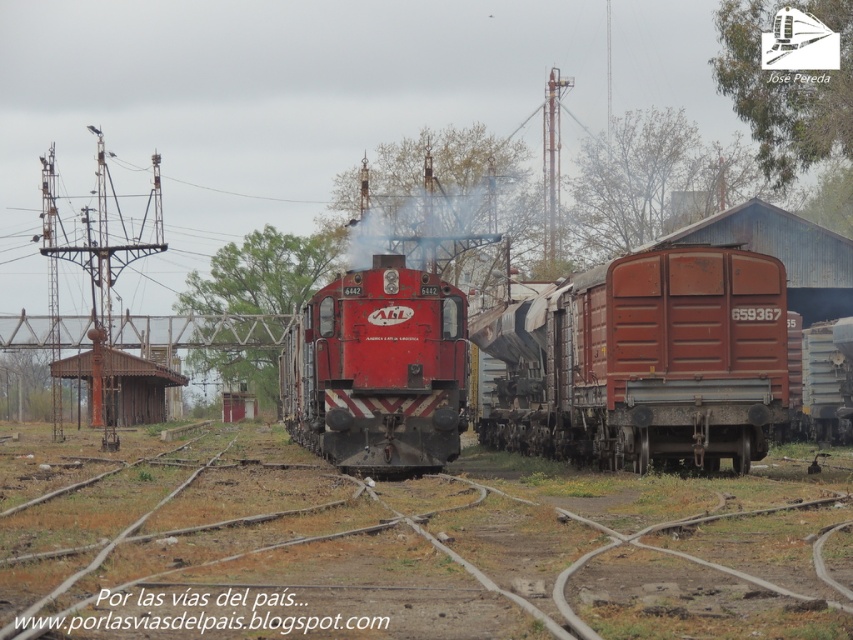
Question: From the image, what is the correct spatial relationship of rusty metal train car at right in relation to shiny red locomotive at center?

Choices:
 (A) below
 (B) above

Answer: (B)

Question: Which point is closer to the camera?

Choices:
 (A) (363, 470)
 (B) (701, 520)
 (C) (662, 406)

Answer: (B)

Question: Is rusty metal train car at right bigger than shiny red locomotive at center?

Choices:
 (A) yes
 (B) no

Answer: (B)

Question: Which of the following is the farthest from the observer?

Choices:
 (A) shiny red locomotive at center
 (B) rusty metal train car at right
 (C) brown dirt train track at center

Answer: (A)

Question: Considering the relative positions of rusty metal train car at right and shiny red locomotive at center in the image provided, where is rusty metal train car at right located with respect to shiny red locomotive at center?

Choices:
 (A) below
 (B) above

Answer: (B)

Question: Which object is closer to the camera taking this photo?

Choices:
 (A) rusty metal train car at right
 (B) shiny red locomotive at center
 (C) brown dirt train track at center

Answer: (C)